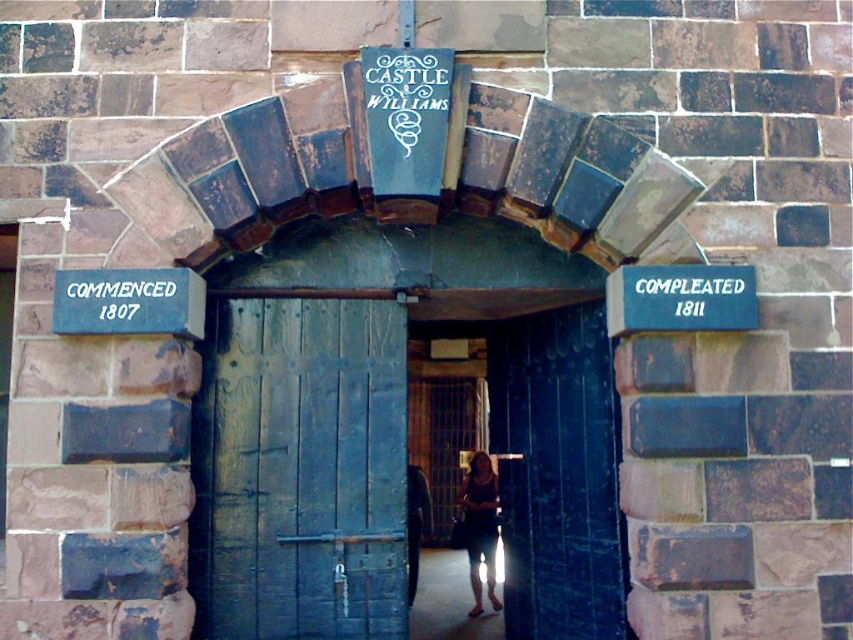
Does point (277, 355) lie in front of point (184, 324)?

No, (277, 355) is behind (184, 324).

Can you confirm if dark blue wood door at center is wider than blue painted wood sign at left?

Yes.

Find the location of a particular element. Image resolution: width=853 pixels, height=640 pixels. dark blue wood door at center is located at coordinates (300, 470).

Identify the location of dark blue wood door at center. The width and height of the screenshot is (853, 640). (300, 470).

Find the location of a particular element. The image size is (853, 640). smooth dark wood door at center is located at coordinates (289, 474).

Which is below, smooth dark wood door at center or blue painted wood sign at right?

smooth dark wood door at center is below.

Find the location of `smooth dark wood door at center`. smooth dark wood door at center is located at coordinates (289, 474).

At what (x,y) coordinates should I click in order to perform the action: click on smooth dark wood door at center. Please return your answer as a coordinate pair (x, y). Image resolution: width=853 pixels, height=640 pixels. Looking at the image, I should click on (289, 474).

Who is positioned more to the left, smooth dark wood door at center or dark blue wood door at center?

Positioned to the left is dark blue wood door at center.

Does point (607, 586) come in front of point (277, 464)?

No.

Who is more forward, (271,532) or (315,432)?

Point (271,532) is more forward.

At what (x,y) coordinates should I click in order to perform the action: click on smooth dark wood door at center. Please return your answer as a coordinate pair (x, y). This screenshot has width=853, height=640. Looking at the image, I should click on (289, 474).